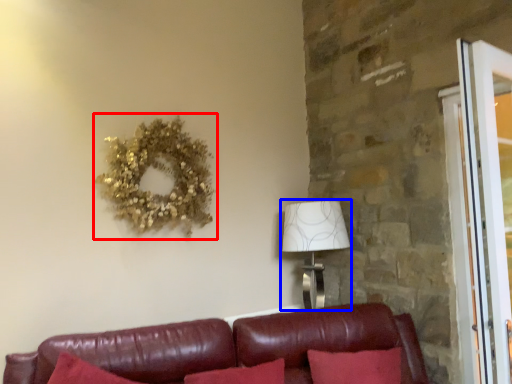
Question: Which of the following is the farthest to the observer, decor (highlighted by a red box) or table lamp (highlighted by a blue box)?

Choices:
 (A) decor
 (B) table lamp

Answer: (B)